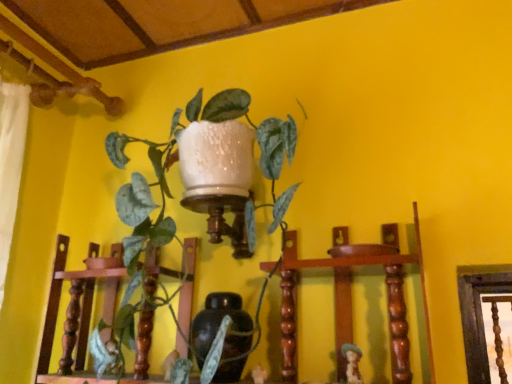
Question: From a real-world perspective, is matte brown figurine at lower right physically located above or below matte brown vase at center?

Choices:
 (A) above
 (B) below

Answer: (B)

Question: Considering the positions of matte brown figurine at lower right and matte brown vase at center in the image, is matte brown figurine at lower right wider or thinner than matte brown vase at center?

Choices:
 (A) thin
 (B) wide

Answer: (A)

Question: Which object is the farthest from the green glossy plant at upper center?

Choices:
 (A) matte brown vase at center
 (B) matte brown figurine at lower right

Answer: (B)

Question: Estimate the real-world distances between objects in this image. Which object is closer to the green glossy plant at upper center?

Choices:
 (A) matte brown vase at center
 (B) matte brown figurine at lower right

Answer: (A)